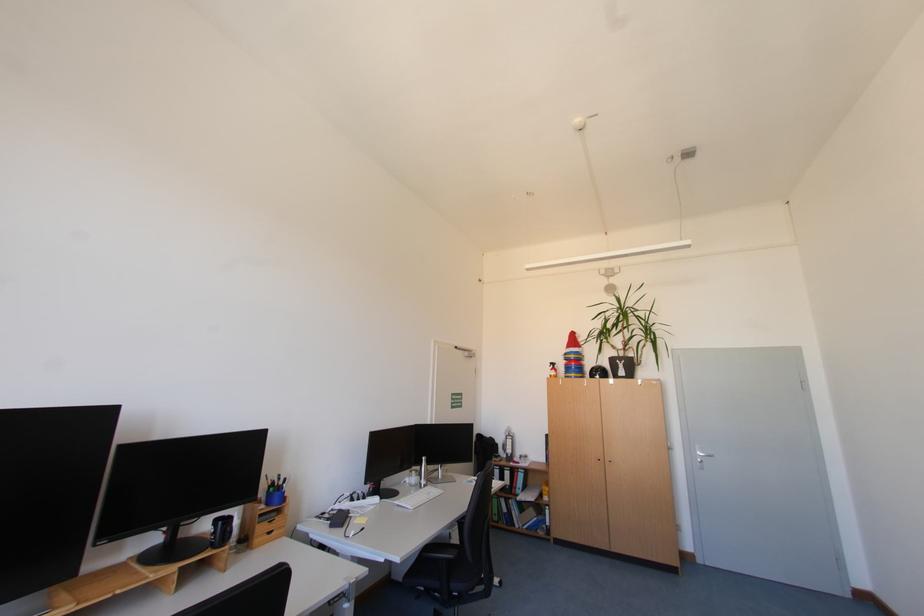
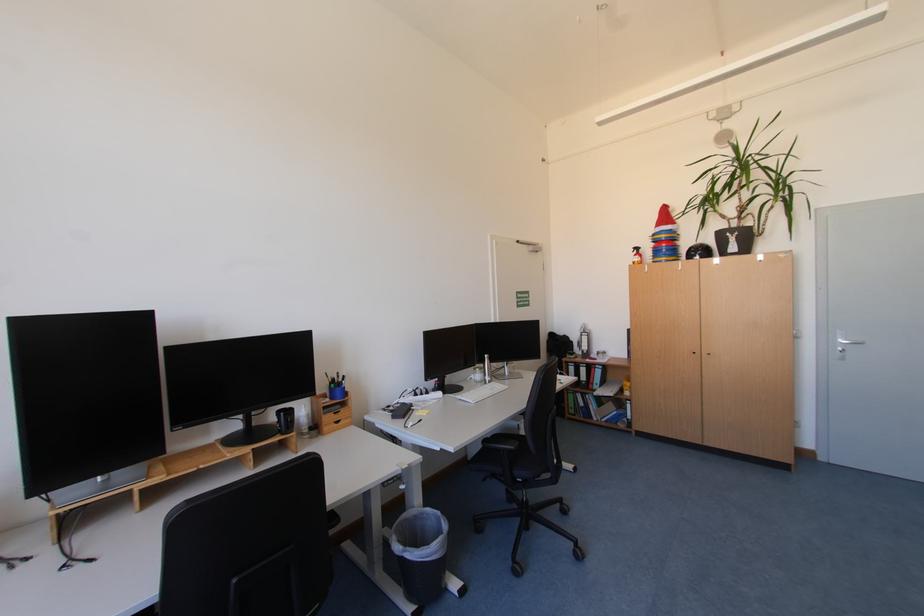
In the second image, find the point that corresponds to point (211, 527) in the first image.

(277, 416)